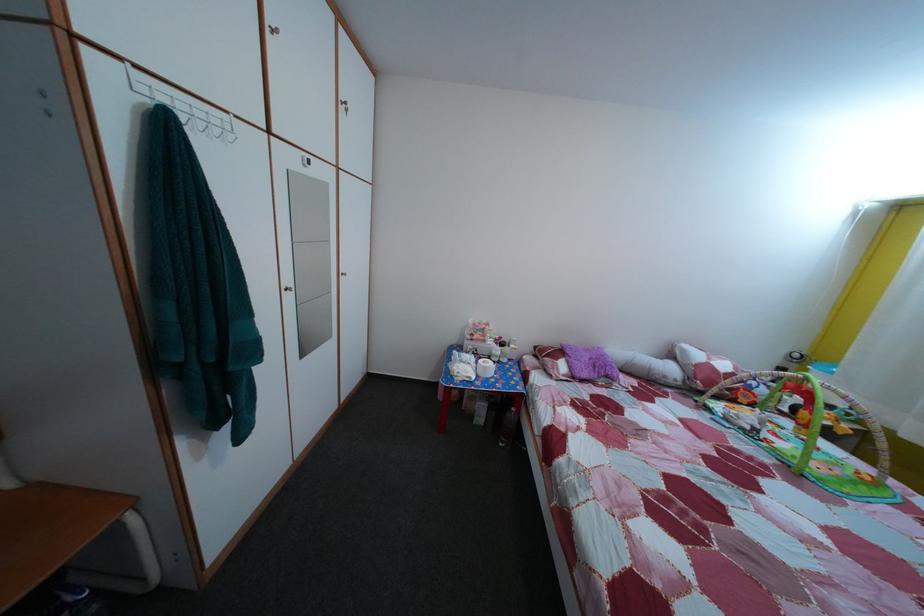
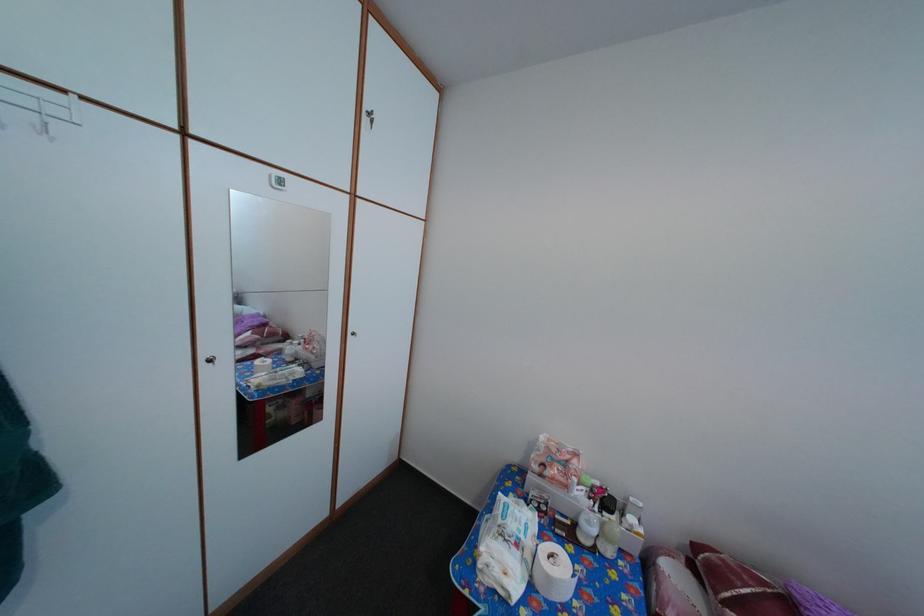
Locate, in the second image, the point that corresponds to point (504, 360) in the first image.

(592, 531)